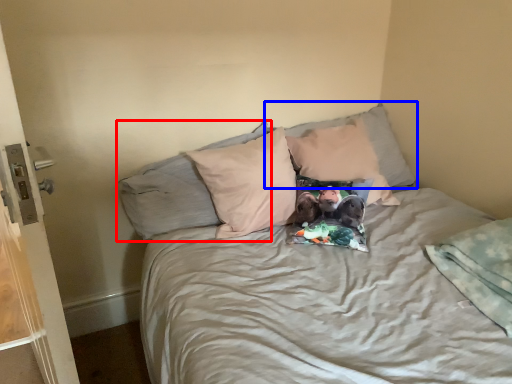
Question: Which object is closer to the camera taking this photo, pillow (highlighted by a red box) or pillow (highlighted by a blue box)?

Choices:
 (A) pillow
 (B) pillow

Answer: (A)